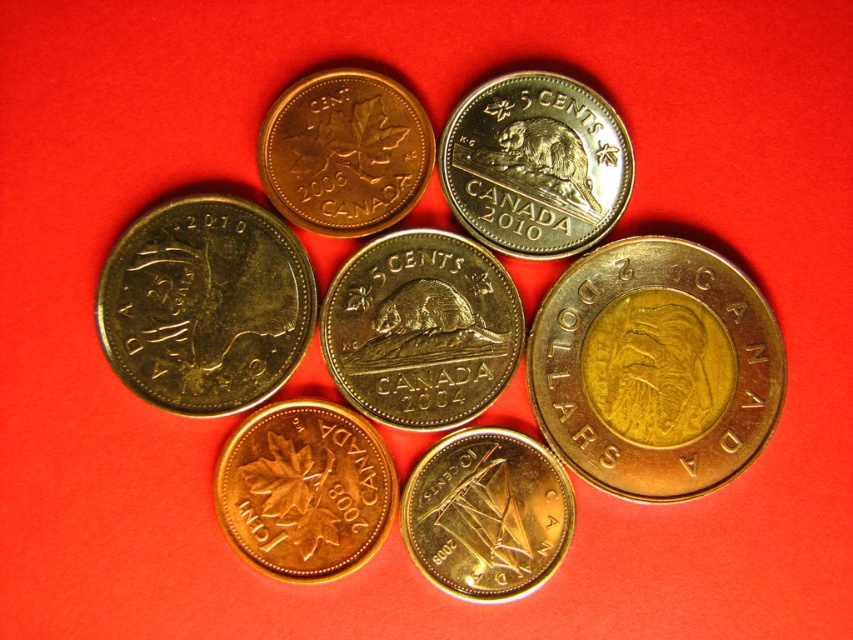
Is gold-plated sailboat at center smaller than gold plated maple leaf at center?

Actually, gold-plated sailboat at center might be larger than gold plated maple leaf at center.

Identify the location of gold-plated sailboat at center. (486, 513).

Identify the location of gold-plated sailboat at center. click(x=486, y=513).

The image size is (853, 640). In order to click on gold plated eagle at center in this screenshot , I will do `click(654, 369)`.

Does gold plated eagle at center have a greater height compared to gold plated coin at center?

Yes, gold plated eagle at center is taller than gold plated coin at center.

Which is behind, point (708, 260) or point (227, 406)?

Positioned behind is point (227, 406).

This screenshot has width=853, height=640. Find the location of `gold plated eagle at center`. gold plated eagle at center is located at coordinates (654, 369).

Between point (428, 342) and point (407, 506), which one is positioned behind?

Positioned behind is point (428, 342).

The width and height of the screenshot is (853, 640). What do you see at coordinates (421, 328) in the screenshot?
I see `gold plated beaver at center` at bounding box center [421, 328].

Locate an element on the screen. gold plated beaver at center is located at coordinates (421, 328).